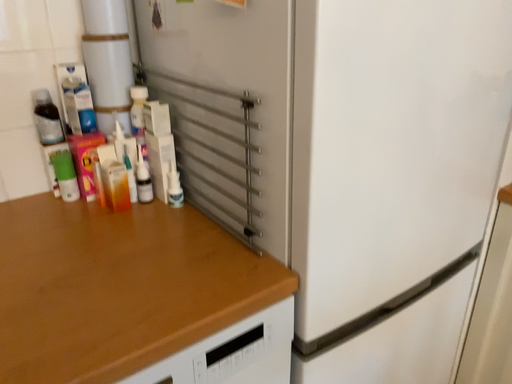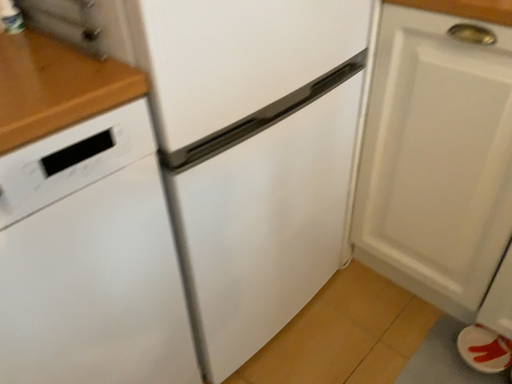
Question: How did the camera likely rotate when shooting the video?

Choices:
 (A) rotated left
 (B) rotated right

Answer: (B)